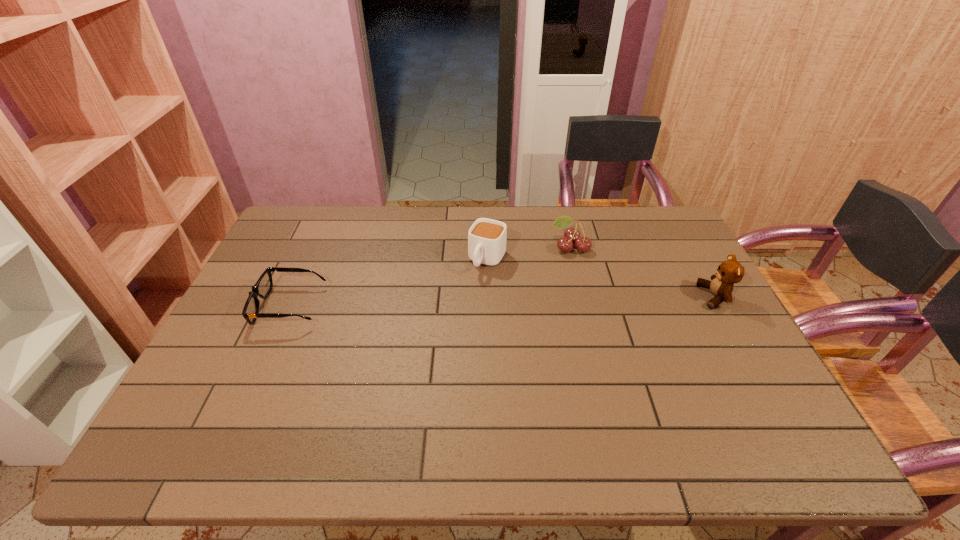
In the image, there is a desktop. Where is `vacant space at the near edge`? The width and height of the screenshot is (960, 540). vacant space at the near edge is located at coordinates (579, 393).

Locate an element on the screen. vacant space at the left edge of the desktop is located at coordinates (247, 333).

In the image, there is a desktop. Where is `vacant space at the far left corner`? Image resolution: width=960 pixels, height=540 pixels. vacant space at the far left corner is located at coordinates (328, 207).

This screenshot has width=960, height=540. Identify the location of free location at the near left corner of the desktop. (216, 411).

Identify the location of blank space at the far right corner of the desktop. (673, 223).

Find the location of `free area in between the sunglasses and the cup`. free area in between the sunglasses and the cup is located at coordinates (389, 283).

This screenshot has width=960, height=540. Identify the location of blank region between the cherry and the cup. (529, 253).

The image size is (960, 540). What are the coordinates of `free spot between the teddy bear and the cup` in the screenshot? It's located at (601, 278).

Identify the location of free space between the second object from right to left and the teddy bear. (642, 272).

The image size is (960, 540). Find the location of `free space between the teddy bear and the second object from left to right`. free space between the teddy bear and the second object from left to right is located at coordinates (601, 278).